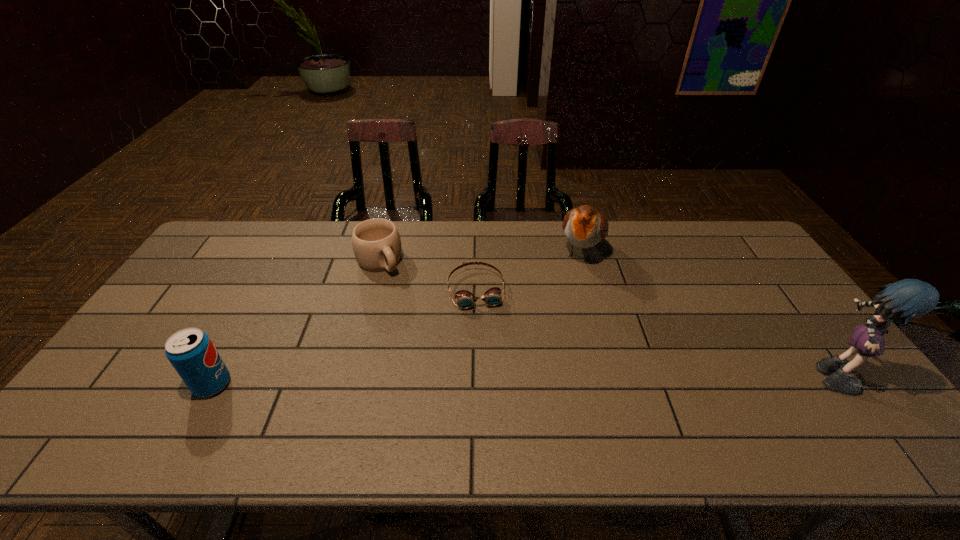
Find the location of a particular element. free space at the far left corner of the desktop is located at coordinates (215, 260).

The width and height of the screenshot is (960, 540). What are the coordinates of `vacant space at the far right corner of the desktop` in the screenshot? It's located at (726, 230).

Find the location of `vacant area at the near right corner of the desktop`. vacant area at the near right corner of the desktop is located at coordinates pos(814,394).

Image resolution: width=960 pixels, height=540 pixels. I want to click on vacant area that lies between the rag doll and the third shortest object, so click(x=521, y=378).

Find the location of a particular element. This screenshot has width=960, height=540. blank region between the third shortest object and the shortest object is located at coordinates (344, 337).

Locate an element on the screen. This screenshot has height=540, width=960. free space between the tallest object and the third tallest object is located at coordinates (521, 378).

You are a GUI agent. You are given a task and a screenshot of the screen. Output one action in this format:
    pyautogui.click(x=<x>, y=<y>)
    Task: Click on the free spot between the soda can and the rightmost object
    Image resolution: width=960 pixels, height=540 pixels.
    Given the screenshot: What is the action you would take?
    pyautogui.click(x=521, y=378)

Locate an element on the screen. The image size is (960, 540). free spot between the shortest object and the rightmost object is located at coordinates (654, 330).

This screenshot has height=540, width=960. Find the location of `unoccupied area between the third object from right to left and the rag doll`. unoccupied area between the third object from right to left and the rag doll is located at coordinates click(x=654, y=330).

Where is `free area in between the fourth object from left to right and the rightmost object`? free area in between the fourth object from left to right and the rightmost object is located at coordinates (707, 312).